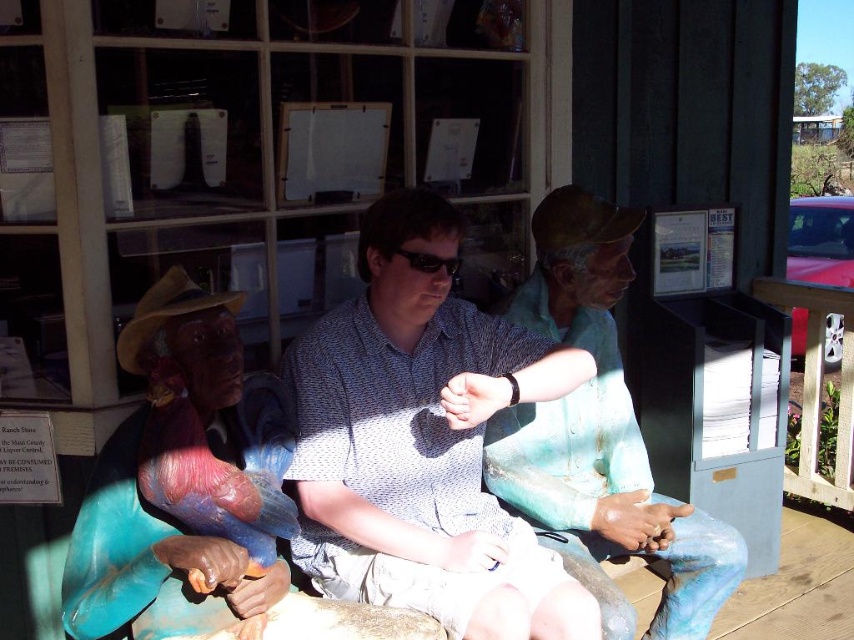
Can you confirm if blue-green painted statue at center is positioned to the left of matte green statue at center?

Correct, you'll find blue-green painted statue at center to the left of matte green statue at center.

Does blue-green painted statue at center have a larger size compared to matte green statue at center?

Actually, blue-green painted statue at center might be smaller than matte green statue at center.

Measure the distance between blue-green painted statue at center and camera.

They are 5.08 feet apart.

Identify the location of blue-green painted statue at center. This screenshot has height=640, width=854. (423, 440).